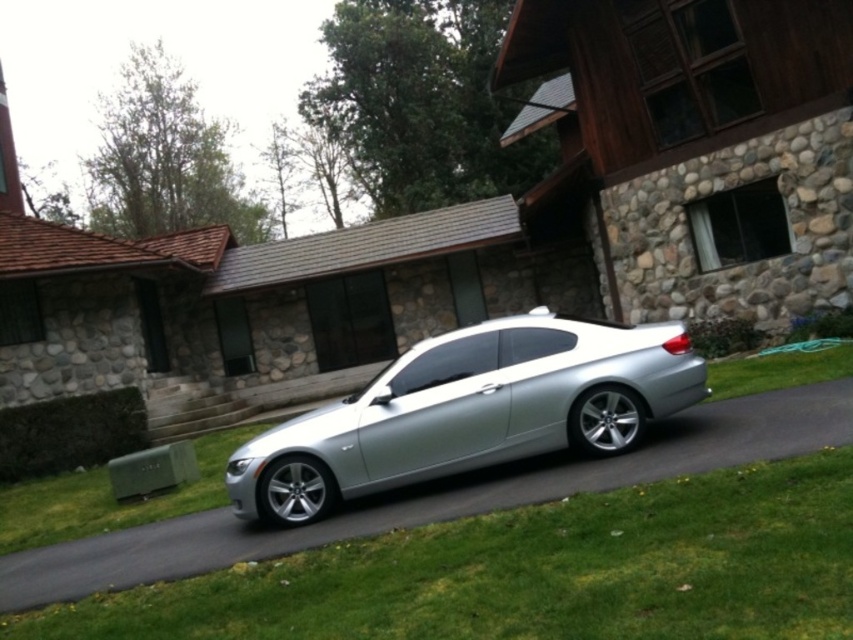
Question: Which point is farther to the camera?

Choices:
 (A) (508, 371)
 (B) (605, 579)

Answer: (A)

Question: Does green grass at lower right have a lesser width compared to satin silver car at center?

Choices:
 (A) no
 (B) yes

Answer: (A)

Question: Where is green grass at lower right located in relation to satin silver car at center in the image?

Choices:
 (A) left
 (B) right

Answer: (A)

Question: Among these points, which one is nearest to the camera?

Choices:
 (A) (827, 605)
 (B) (505, 337)

Answer: (A)

Question: Is green grass at lower right to the right of satin silver car at center from the viewer's perspective?

Choices:
 (A) no
 (B) yes

Answer: (A)

Question: Which of the following is the closest to the observer?

Choices:
 (A) pyautogui.click(x=576, y=348)
 (B) pyautogui.click(x=503, y=538)

Answer: (B)